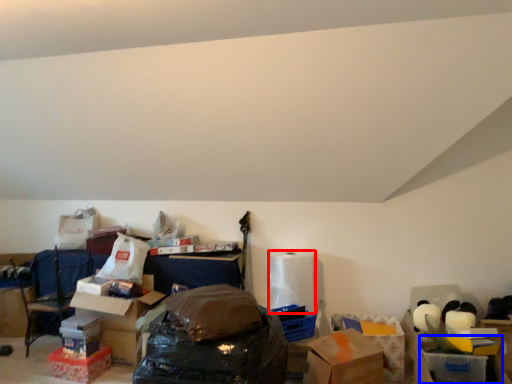
Question: Which point is closer to the camera, toilet paper (highlighted by a red box) or storage box (highlighted by a blue box)?

Choices:
 (A) toilet paper
 (B) storage box

Answer: (B)